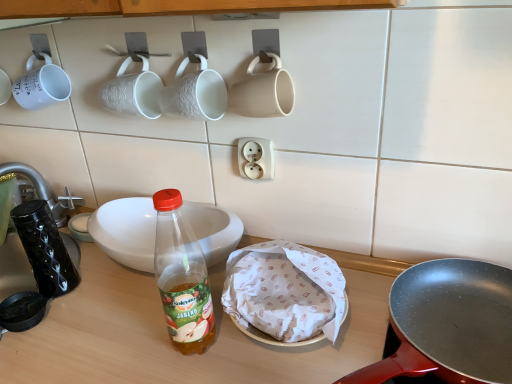
I want to click on free space in front of white ceramic bowl at center, so click(130, 335).